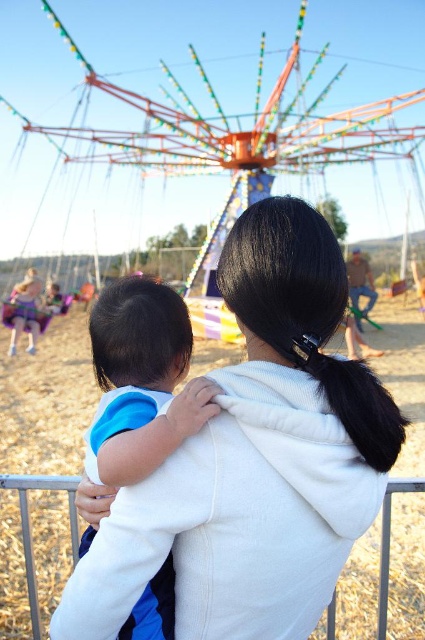
Looking at this image, you are at an amusement park and see a woman wearing a white fleece jacket at center holding a child. There is also a white fabric at center in the scene. Which object is closer to you, the observer?

The white fleece jacket at center is closer to you because it is in front of the white fabric at center.

You are at the fairground and see a woman holding a child wearing the blue cotton shirt at center and the white fabric at center. Which piece of clothing is closer to the left side?

The blue cotton shirt at center is closer to the left side because it is positioned to the left of the white fabric at center.